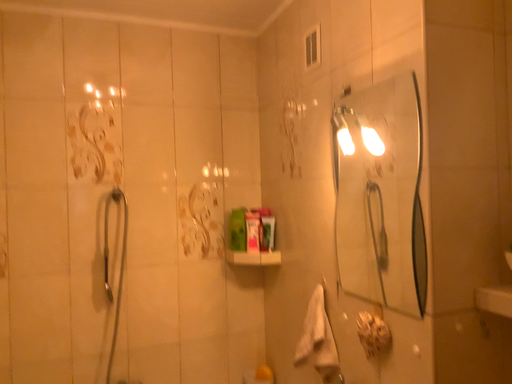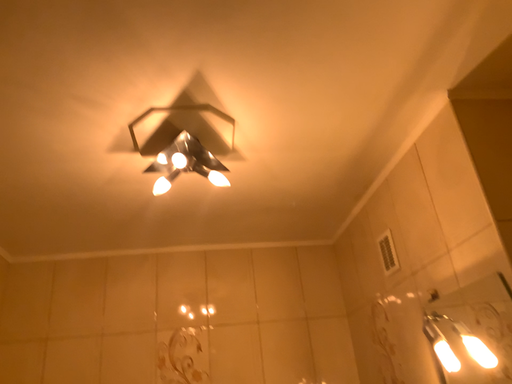
Question: Which way did the camera rotate in the video?

Choices:
 (A) rotated upward
 (B) rotated downward

Answer: (A)